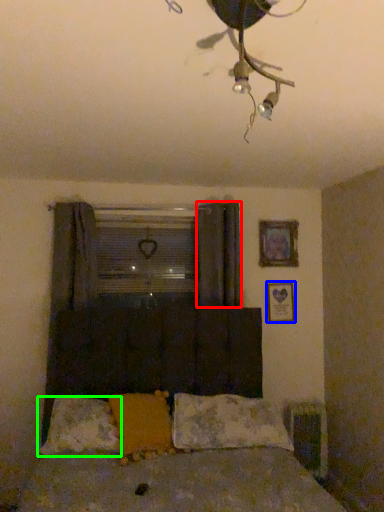
Question: Which object is the farthest from curtain (highlighted by a red box)? Choose among these: picture frame (highlighted by a blue box) or pillow (highlighted by a green box).

Choices:
 (A) picture frame
 (B) pillow

Answer: (B)